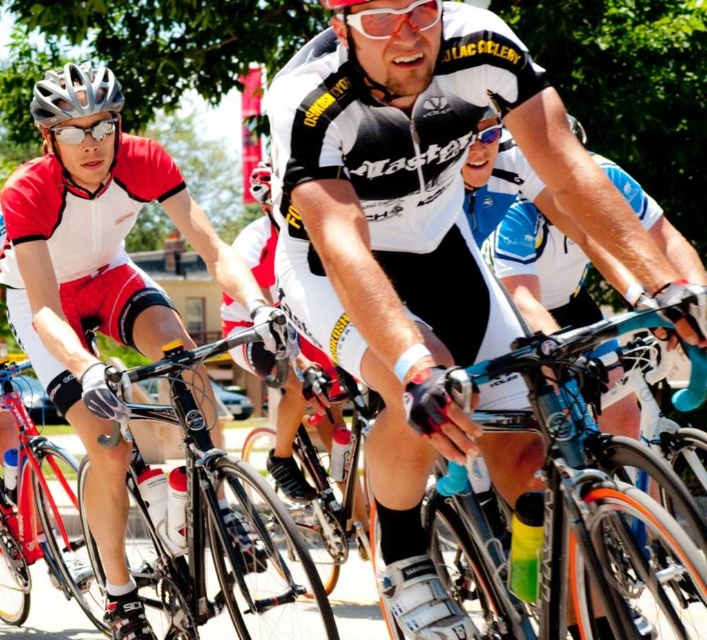
You are a GUI agent. You are given a task and a screenshot of the screen. Output one action in this format:
    pyautogui.click(x=<x>, y=<y>)
    Task: Click on the silver metallic helmet at left
    This screenshot has width=707, height=640.
    Given the screenshot: What is the action you would take?
    pyautogui.click(x=78, y=120)

Looking at this image, how distant is silver metallic helmet at left from silver metallic helmet at upper left?

silver metallic helmet at left is 9.81 inches away from silver metallic helmet at upper left.

Is point (105, 160) positioned behind point (52, 116)?

That is True.

At what (x,y) coordinates should I click in order to perform the action: click on silver metallic helmet at left. Please return your answer as a coordinate pair (x, y). Looking at the image, I should click on (78, 120).

In the scene shown: Does white matte jersey at center appear under silver metallic helmet at upper left?

Correct, white matte jersey at center is located below silver metallic helmet at upper left.

Can you confirm if white matte jersey at center is positioned above silver metallic helmet at upper left?

Actually, white matte jersey at center is below silver metallic helmet at upper left.

Where is `white matte jersey at center`? white matte jersey at center is located at coordinates (426, 252).

You are a GUI agent. You are given a task and a screenshot of the screen. Output one action in this format:
    pyautogui.click(x=<x>, y=<y>)
    Task: Click on the white matte jersey at center
    This screenshot has height=640, width=707.
    Given the screenshot: What is the action you would take?
    pyautogui.click(x=426, y=252)

Can you confirm if shiny red bicycle at center is smaller than red translucent goggles at center?

No.

Find the location of a particular element. This screenshot has width=707, height=640. shiny red bicycle at center is located at coordinates (40, 512).

Identify the location of shiny red bicycle at center. This screenshot has width=707, height=640. (40, 512).